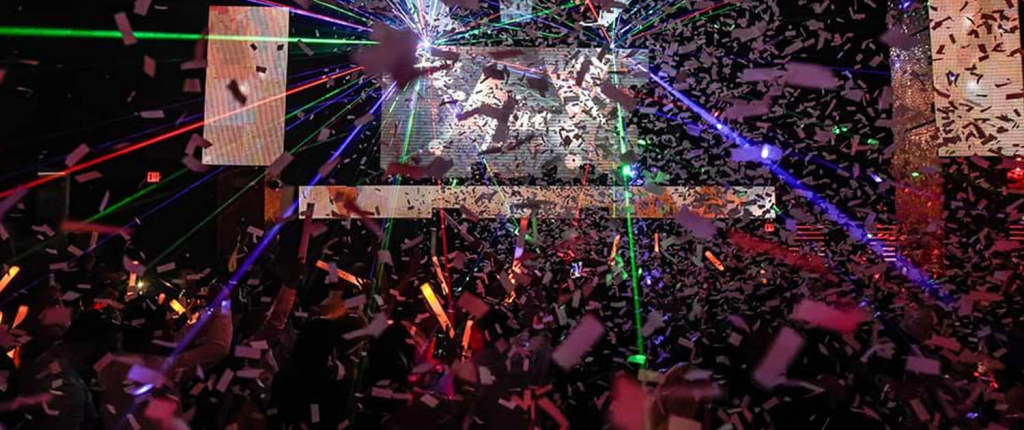
Find the location of a particular element. This screenshot has height=430, width=1024. green light is located at coordinates (631, 246).